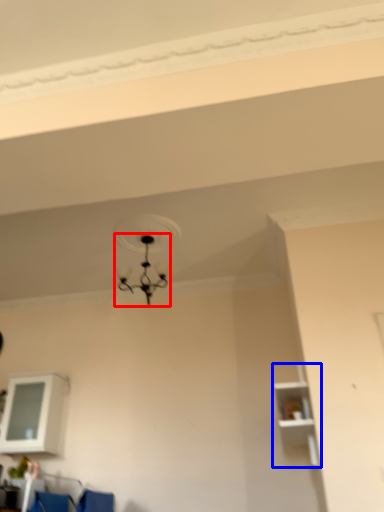
Question: Among these objects, which one is farthest to the camera, lamp (highlighted by a red box) or shelf (highlighted by a blue box)?

Choices:
 (A) lamp
 (B) shelf

Answer: (A)